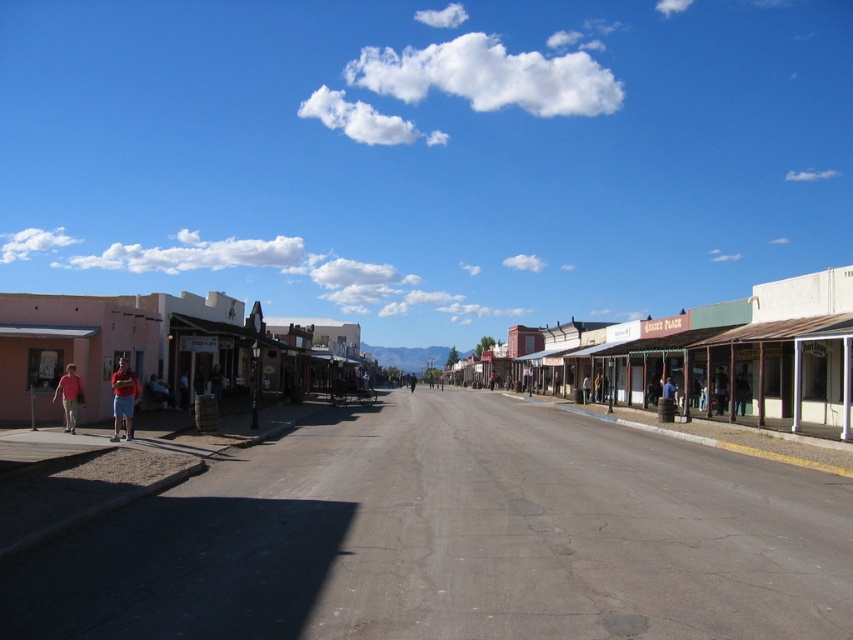
In the scene shown: You are a delivery person who needs to deliver a package to the matte pink building at left. You are currently standing at the blue denim jeans at center. Which direction should you walk to reach the building?

The matte pink building at left is taller than the blue denim jeans at center, so you should walk towards the left to reach the building.

You are a tourist standing on the street and see the matte pink building at left and the matte red shorts at left. Which object is positioned further to the left?

The matte pink building at left is positioned further to the left than the matte red shorts at left.